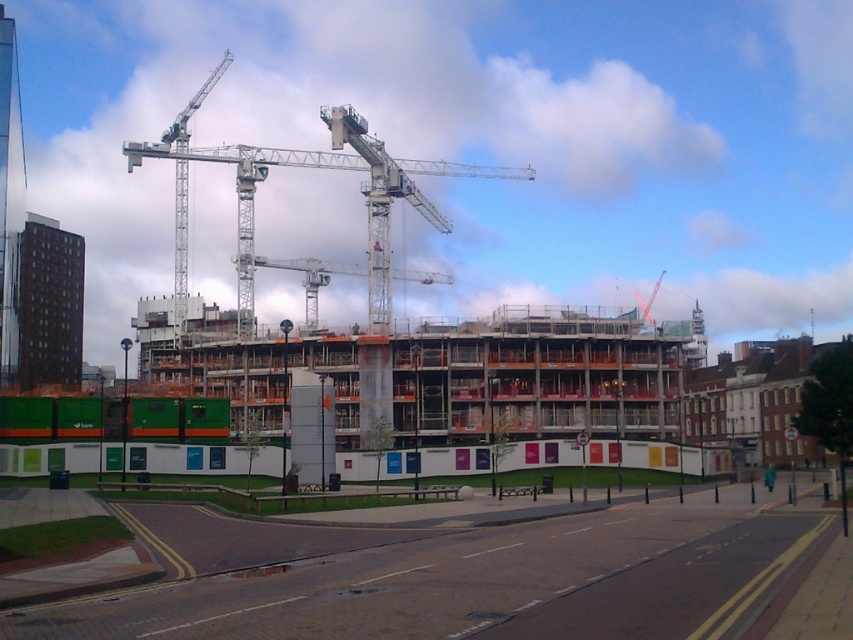
Which is behind, point (221, 596) or point (271, 156)?

The point (271, 156) is more distant.

Between concrete wall at center and white metallic crane at upper center, which one is positioned higher?

white metallic crane at upper center

This screenshot has width=853, height=640. What do you see at coordinates (486, 582) in the screenshot? I see `concrete wall at center` at bounding box center [486, 582].

Image resolution: width=853 pixels, height=640 pixels. What are the coordinates of `concrete wall at center` in the screenshot? It's located at (486, 582).